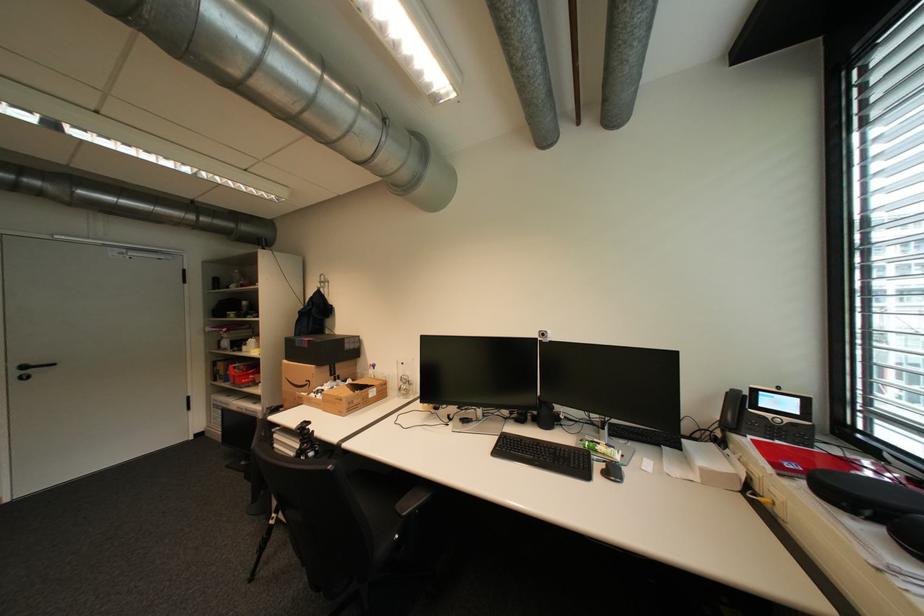
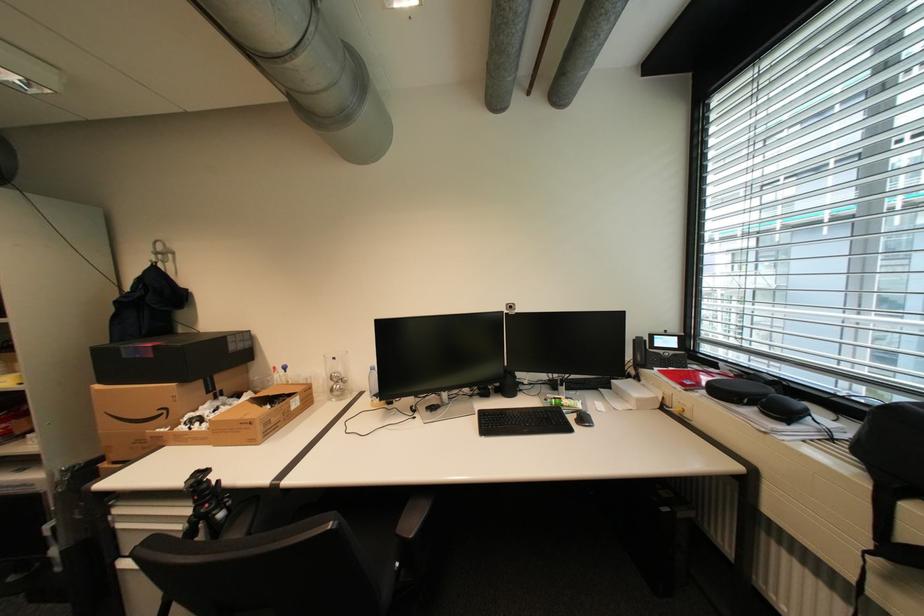
Where in the second image is the point corresponding to point (796, 466) from the first image?

(695, 383)